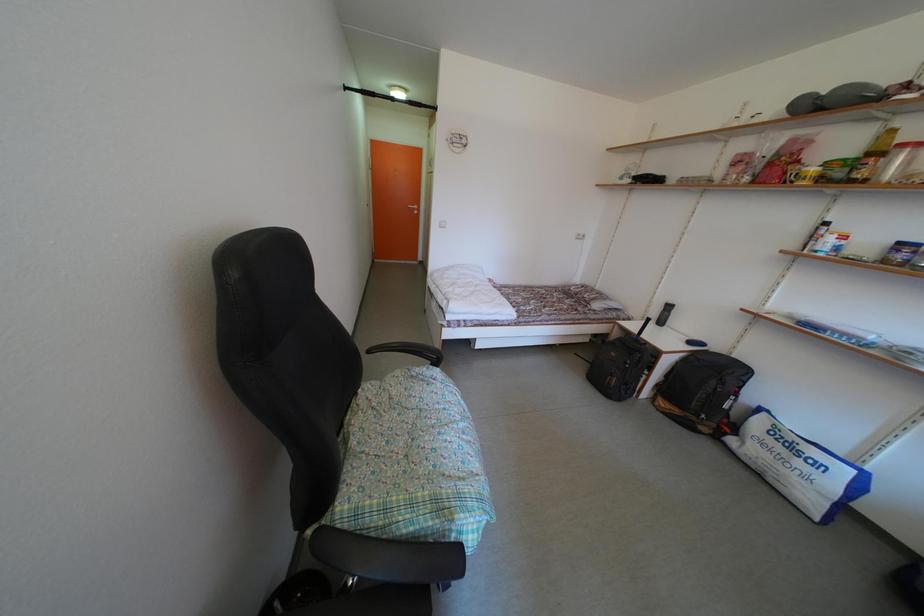
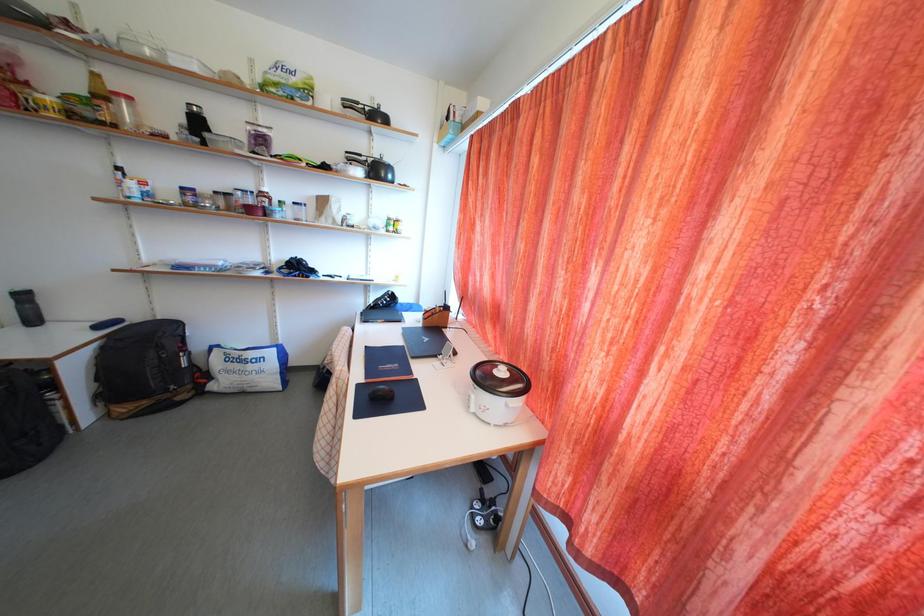
First-person continuous shooting, in which direction is the camera rotating?

The camera rotated toward right-down.